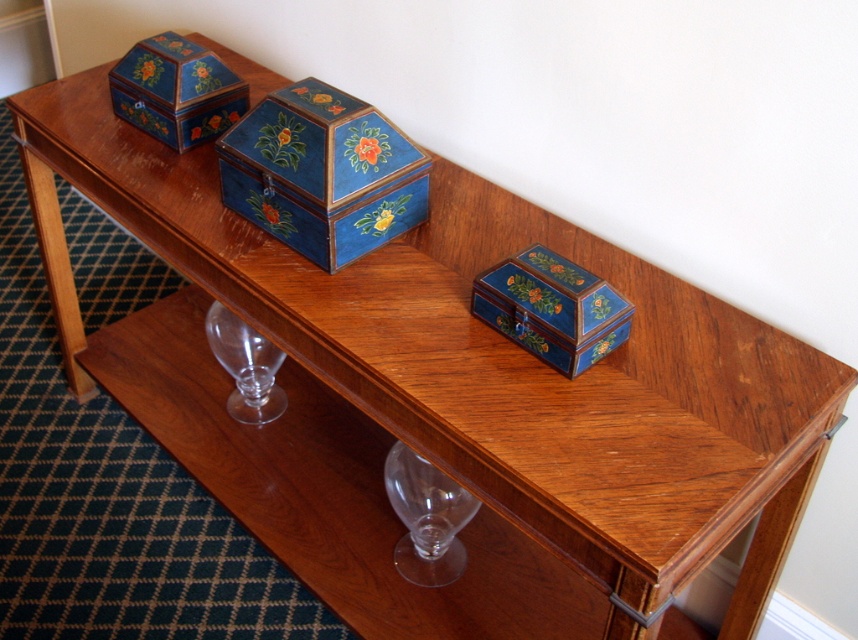
Which is in front, point (281, 168) or point (606, 317)?

Positioned in front is point (606, 317).

Can you confirm if blue painted wood box at center is wider than matte blue wooden box at center?

Yes.

Is point (305, 188) farther from viewer compared to point (589, 285)?

That is True.

Where is `blue painted wood box at center`? The height and width of the screenshot is (640, 858). blue painted wood box at center is located at coordinates (323, 173).

Is blue painted wood box at upper left taller than transparent glass wine glass at lower left?

No.

Between blue painted wood box at upper left and transparent glass wine glass at lower left, which one is positioned lower?

Positioned lower is transparent glass wine glass at lower left.

Which is in front, point (173, 67) or point (224, 342)?

Positioned in front is point (173, 67).

I want to click on blue painted wood box at upper left, so click(x=176, y=90).

Which is behind, point (275, 120) or point (431, 483)?

The point (431, 483) is more distant.

Does blue painted wood box at center have a lesser height compared to transparent glass wine glass at lower center?

No.

Between point (287, 221) and point (430, 572), which one is positioned in front?

Point (287, 221) is in front.

At what (x,y) coordinates should I click in order to perform the action: click on blue painted wood box at center. Please return your answer as a coordinate pair (x, y). Looking at the image, I should click on (323, 173).